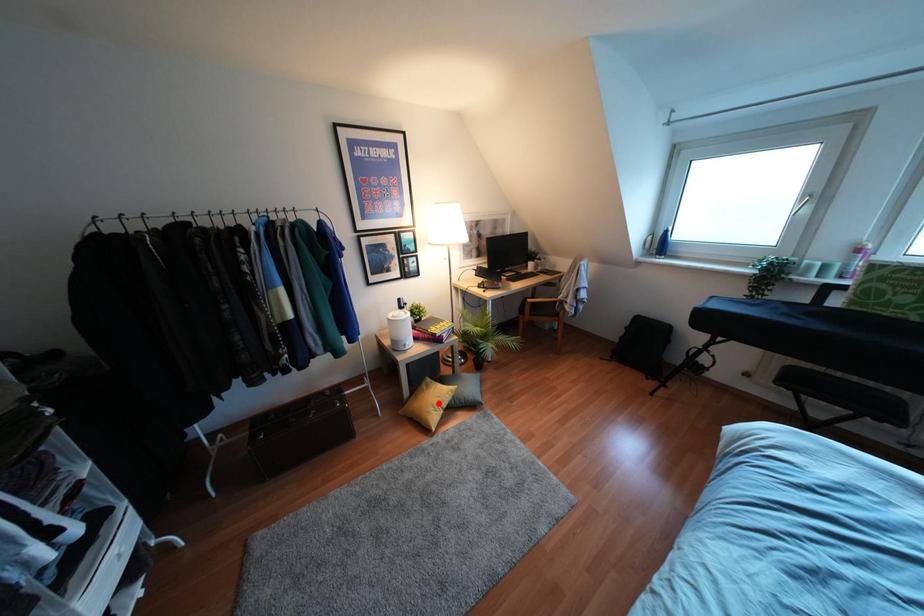
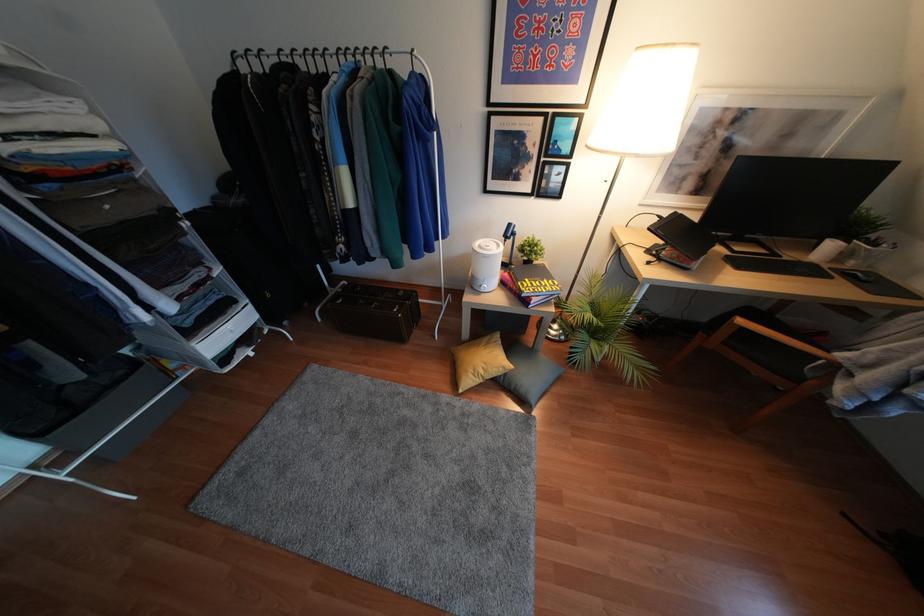
Where in the second image is the point corresponding to the highlighted location from the first image?

(480, 371)